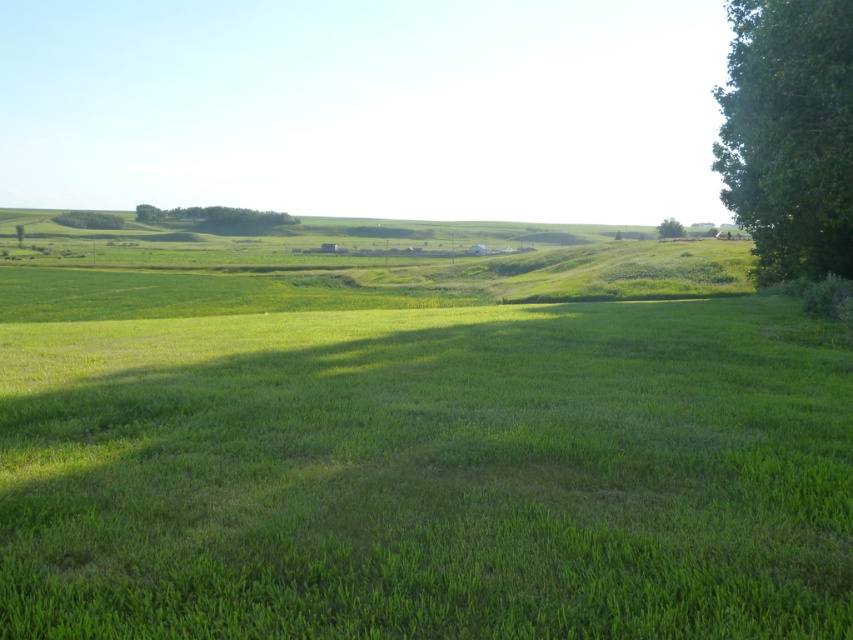
You are standing at the origin point in the image. Which direction should you move to reach the green leafy trees at center?

The green leafy trees at center are located at coordinates approximately 0.342 on the x axis and 0.256 on the y axis. Since you are at the origin, you should move towards the positive x and positive y direction to reach them.